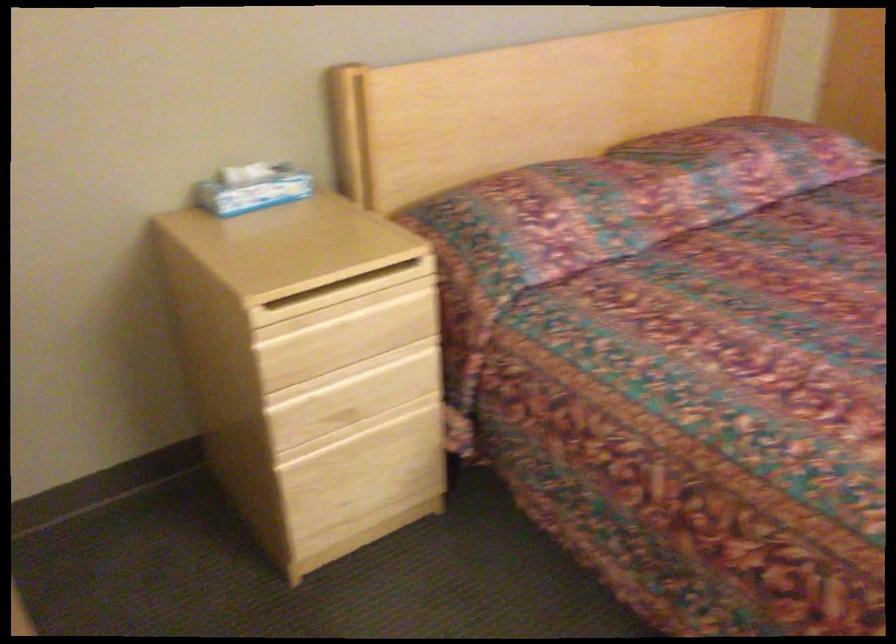
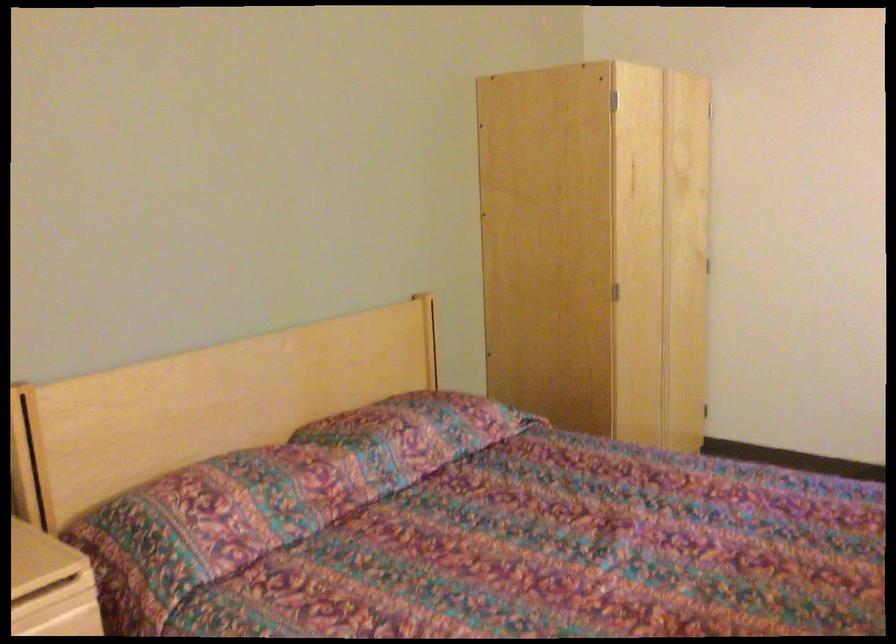
Find the pixel in the second image that matches (751,163) in the first image.

(414, 433)